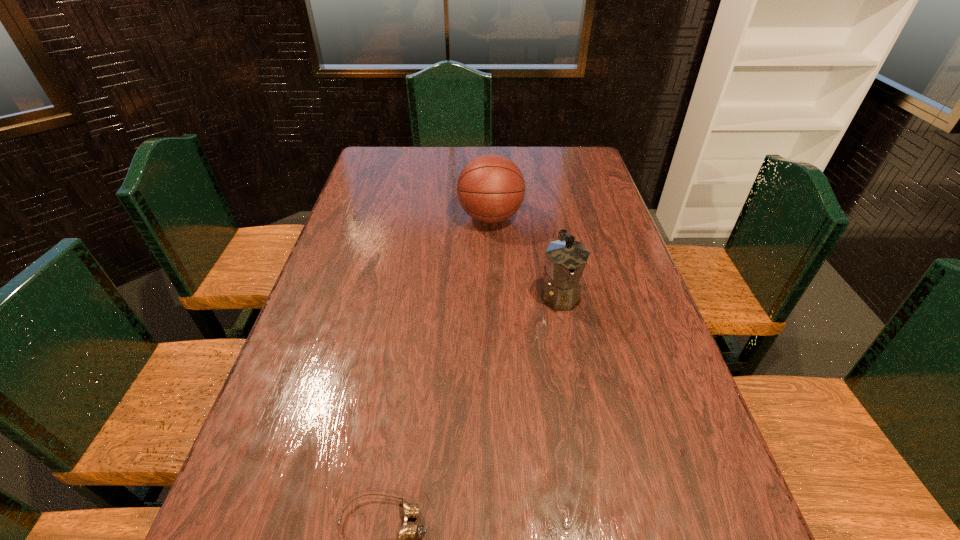
I want to click on the second object from left to right, so click(491, 188).

Where is `basketball`? This screenshot has height=540, width=960. basketball is located at coordinates (491, 188).

This screenshot has height=540, width=960. Identify the location of coffeepot. (566, 259).

I want to click on the rightmost object, so click(x=566, y=259).

At what (x,y) coordinates should I click in order to perform the action: click on free location located 0.190m on the left of the farthest object. Please return your answer as a coordinate pair (x, y). Looking at the image, I should click on (401, 218).

Locate an element on the screen. This screenshot has width=960, height=540. vacant region located 0.190m on the pouring side of the second farthest object is located at coordinates (576, 381).

Image resolution: width=960 pixels, height=540 pixels. Find the location of `free region at the far edge`. free region at the far edge is located at coordinates (x=477, y=153).

Locate an element on the screen. This screenshot has height=540, width=960. vacant space at the left edge of the desktop is located at coordinates (348, 304).

At what (x,y) coordinates should I click in order to perform the action: click on vacant space at the right edge. Please return your answer as a coordinate pair (x, y). This screenshot has height=540, width=960. Looking at the image, I should click on (603, 183).

This screenshot has height=540, width=960. I want to click on free space that is in between the second object from left to right and the coffeepot, so click(525, 256).